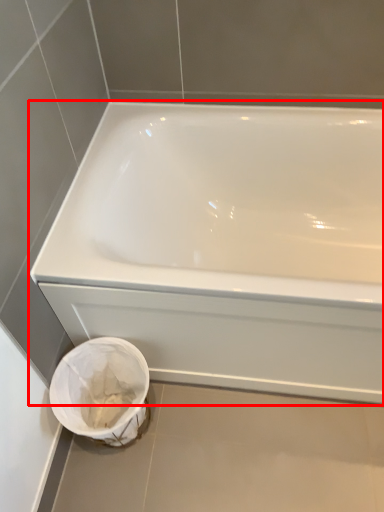
Question: Where is bathtub (annotated by the red box) located in relation to porcelain in the image?

Choices:
 (A) right
 (B) left

Answer: (A)